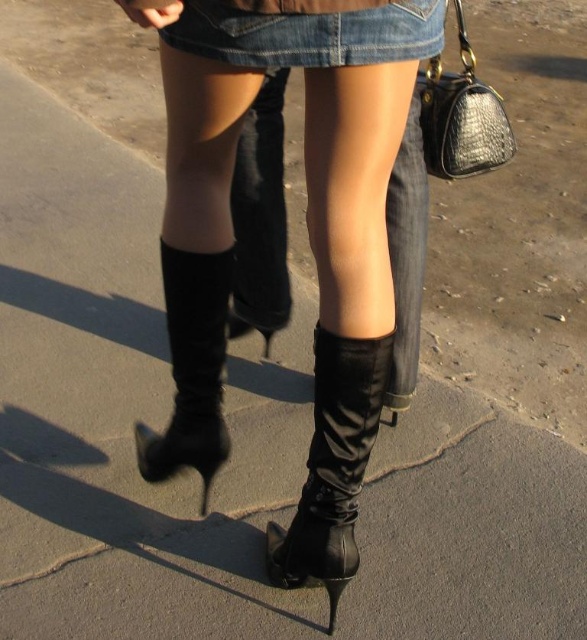
Question: Among these points, which one is farthest from the camera?

Choices:
 (A) (353, 84)
 (B) (176, 426)
 (C) (316, 424)

Answer: (B)

Question: Considering the real-world distances, which object is farthest from the black leather boot at lower center?

Choices:
 (A) satin black boots at center
 (B) black leather boots at lower center
 (C) black satin boot at lower center

Answer: (A)

Question: From the image, what is the correct spatial relationship of satin black boots at center in relation to denim shorts at upper center?

Choices:
 (A) below
 (B) above

Answer: (A)

Question: From the image, what is the correct spatial relationship of denim shorts at upper center in relation to black leather boot at lower center?

Choices:
 (A) left
 (B) right

Answer: (B)

Question: Which object is closer to the camera taking this photo?

Choices:
 (A) denim shorts at upper center
 (B) satin black boots at center
 (C) black satin boot at lower center
 (D) black leather boots at lower center

Answer: (A)

Question: Does satin black boots at center appear under black leather boots at lower center?

Choices:
 (A) yes
 (B) no

Answer: (A)